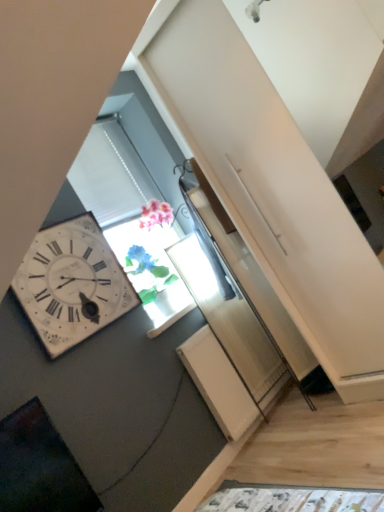
What is the approximate height of translucent glass vase at center?

The height of translucent glass vase at center is 20.88 inches.

This screenshot has width=384, height=512. I want to click on translucent glass vase at center, so click(151, 271).

Describe the element at coordinates (151, 271) in the screenshot. I see `translucent glass vase at center` at that location.

Find the location of a particular element. white wooden wall clock at left is located at coordinates pyautogui.click(x=72, y=284).

What do you see at coordinates (72, 284) in the screenshot? Image resolution: width=384 pixels, height=512 pixels. I see `white wooden wall clock at left` at bounding box center [72, 284].

Measure the distance between point (35, 252) and camera.

They are 6.88 feet apart.

Image resolution: width=384 pixels, height=512 pixels. I want to click on translucent glass vase at center, so click(151, 271).

Visually, is white wooden wall clock at left positioned to the left or to the right of translucent glass vase at center?

Based on their positions, white wooden wall clock at left is located to the left of translucent glass vase at center.

Considering the positions of objects white wooden wall clock at left and translucent glass vase at center in the image provided, who is behind, white wooden wall clock at left or translucent glass vase at center?

translucent glass vase at center is further away from the camera.

Between point (30, 247) and point (109, 234), which one is positioned in front?

The point (30, 247) is more forward.

From the image's perspective, would you say white wooden wall clock at left is positioned over translucent glass vase at center?

No, from the image's perspective, white wooden wall clock at left is not over translucent glass vase at center.

From a real-world perspective, is white wooden wall clock at left over translucent glass vase at center?

Yes, from a real-world perspective, white wooden wall clock at left is over translucent glass vase at center

Does white wooden wall clock at left have a lesser width compared to translucent glass vase at center?

Yes, white wooden wall clock at left is thinner than translucent glass vase at center.

Is white wooden wall clock at left taller than translucent glass vase at center?

Correct, white wooden wall clock at left is much taller as translucent glass vase at center.

Can you confirm if white wooden wall clock at left is smaller than translucent glass vase at center?

Indeed, white wooden wall clock at left has a smaller size compared to translucent glass vase at center.

Is white wooden wall clock at left not within translucent glass vase at center?

Yes, white wooden wall clock at left is not within translucent glass vase at center.

Is white wooden wall clock at left far away from translucent glass vase at center?

They are positioned close to each other.

Is white wooden wall clock at left oriented away from translucent glass vase at center?

No, white wooden wall clock at left is not facing the opposite direction of translucent glass vase at center.

How different are the orientations of white wooden wall clock at left and translucent glass vase at center in degrees?

1.04 degrees.

Locate an element on the screen. This screenshot has width=384, height=512. window behind the white wooden wall clock at left is located at coordinates (151, 271).

Which is more to the left, translucent glass vase at center or white wooden wall clock at left?

white wooden wall clock at left.

Is translucent glass vase at center in front of white wooden wall clock at left?

No, translucent glass vase at center is further to the viewer.

Does point (174, 273) come closer to viewer compared to point (47, 289)?

No.

From the image's perspective, is translucent glass vase at center positioned above or below white wooden wall clock at left?

translucent glass vase at center is above white wooden wall clock at left.

From a real-world perspective, is translucent glass vase at center above or below white wooden wall clock at left?

translucent glass vase at center is situated lower than white wooden wall clock at left in the real world.

Consider the image. Considering the relative sizes of translucent glass vase at center and white wooden wall clock at left in the image provided, is translucent glass vase at center wider than white wooden wall clock at left?

Indeed, translucent glass vase at center has a greater width compared to white wooden wall clock at left.

Which of these two, translucent glass vase at center or white wooden wall clock at left, stands taller?

Standing taller between the two is white wooden wall clock at left.

Based on the photo, is translucent glass vase at center smaller than white wooden wall clock at left?

Incorrect, translucent glass vase at center is not smaller in size than white wooden wall clock at left.

From the picture: Is translucent glass vase at center outside of white wooden wall clock at left?

Absolutely, translucent glass vase at center is external to white wooden wall clock at left.

Is translucent glass vase at center touching white wooden wall clock at left?

translucent glass vase at center is not next to white wooden wall clock at left, and they're not touching.

Could you tell me if translucent glass vase at center is facing white wooden wall clock at left?

No, translucent glass vase at center is not facing towards white wooden wall clock at left.

I want to click on wall clock located above the translucent glass vase at center (from a real-world perspective), so click(x=72, y=284).

At what (x,y) coordinates should I click in order to perform the action: click on window that appears above the white wooden wall clock at left (from the image's perspective). Please return your answer as a coordinate pair (x, y). The image size is (384, 512). Looking at the image, I should click on (151, 271).

This screenshot has width=384, height=512. Find the location of `wall clock located in front of the translucent glass vase at center`. wall clock located in front of the translucent glass vase at center is located at coordinates (72, 284).